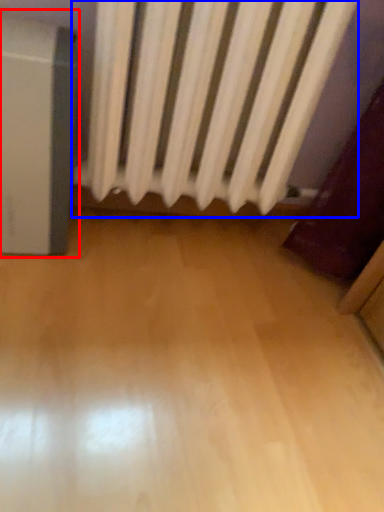
Question: Among these objects, which one is farthest to the camera, appliance (highlighted by a red box) or curtain (highlighted by a blue box)?

Choices:
 (A) appliance
 (B) curtain

Answer: (A)